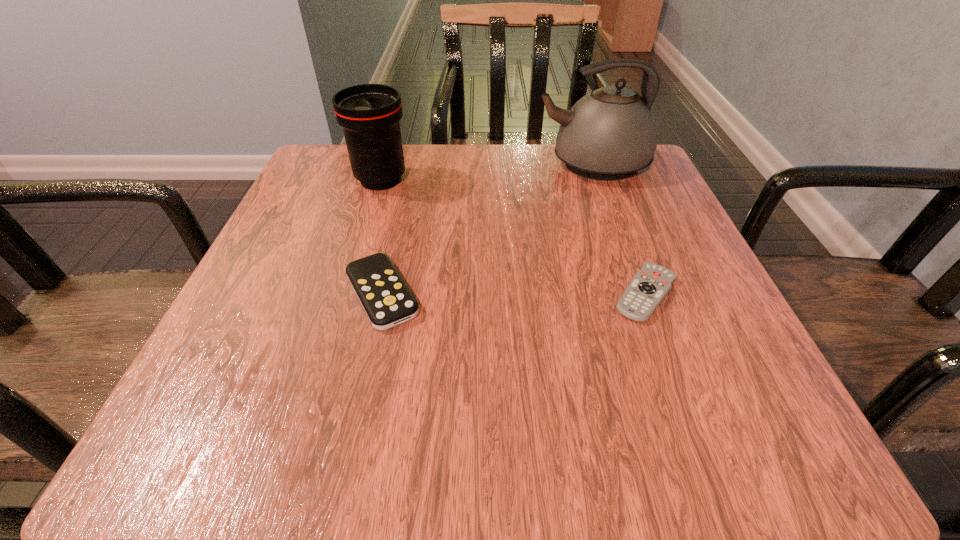
Where is `kettle`? kettle is located at coordinates (609, 134).

Locate an element on the screen. telephoto lens is located at coordinates (369, 113).

What are the coordinates of `the second shortest object` in the screenshot? It's located at (386, 299).

At what (x,y) coordinates should I click in order to perform the action: click on the taller remote control. Please return your answer as a coordinate pair (x, y). Looking at the image, I should click on (386, 299).

Where is `the right remote control`? The width and height of the screenshot is (960, 540). the right remote control is located at coordinates (649, 286).

At what (x,y) coordinates should I click in order to perform the action: click on the shorter remote control. Please return your answer as a coordinate pair (x, y). Looking at the image, I should click on (649, 286).

Locate an element on the screen. The image size is (960, 540). vacant space located at the spout of the kettle is located at coordinates [x=438, y=164].

This screenshot has height=540, width=960. In order to click on vacant space located at the spout of the kettle in this screenshot , I will do `click(493, 164)`.

Find the location of a particular element. vacant space located at the spout of the kettle is located at coordinates (489, 164).

This screenshot has width=960, height=540. I want to click on vacant space situated on the right of the second tallest object, so click(x=468, y=179).